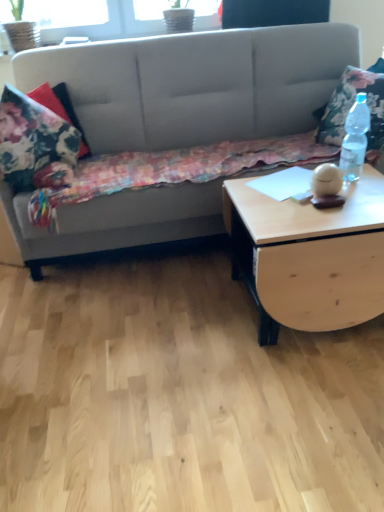
Image resolution: width=384 pixels, height=512 pixels. I want to click on free location in front of clear plastic bottle at right, so click(x=363, y=192).